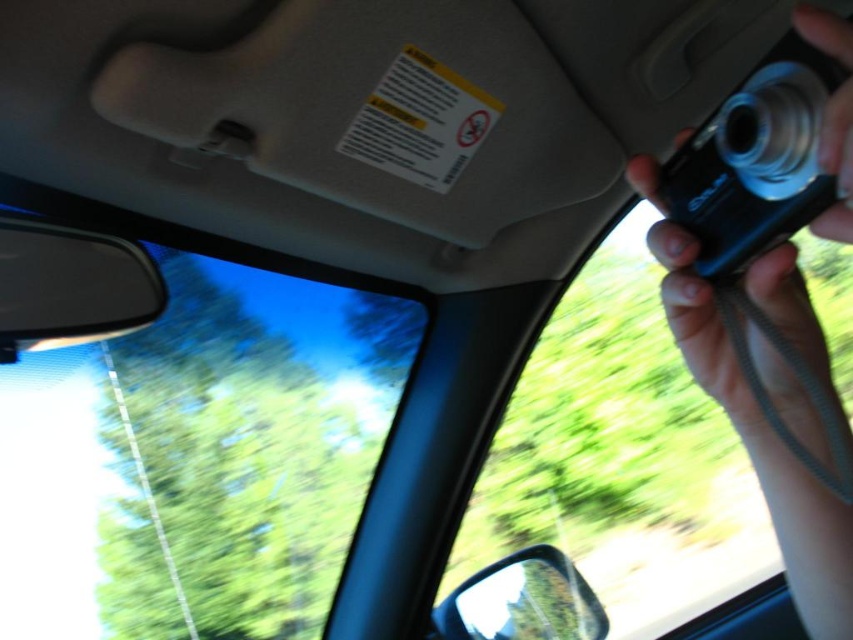
You are holding a Sony camera attached to a gray lanyard. You want to take a photo of the black plastic car mirror at left without moving your hand. Can you confirm if the camera is close enough to capture the mirror in focus?

The distance between the camera and the black plastic car mirror at left is 31.36 inches, so the camera can focus on it as most cameras can focus within that range.

You are a photographer trying to capture a landscape through the transparent glass car window at upper left while holding the black plastic camera at right. Can you position the camera so that the entire window fits in the frame without any part being cut off?

The transparent glass car window at upper left is larger than the black plastic camera at right, so the camera may not be able to capture the entire window in one frame due to its smaller size.

You are a passenger in a car and want to take a photo through the transparent glass car window at upper left. Considering your current position, can you reach the window to take the photo?

The transparent glass car window at upper left is 4.39 feet away from viewer, so yes, you can reach it to take the photo.